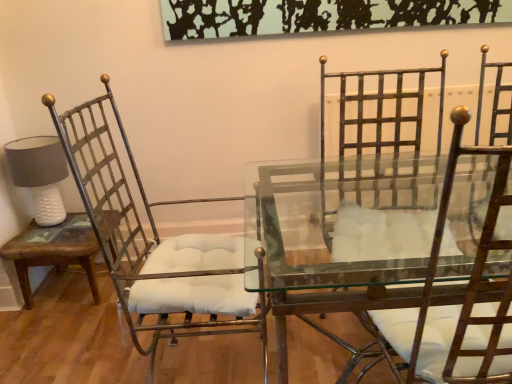
Question: Can you confirm if metallic iron chair at right, the second chair when ordered from left to right, is smaller than brown wood side table at left?

Choices:
 (A) yes
 (B) no

Answer: (B)

Question: From the image's perspective, is metallic iron chair at right, arranged as the first chair when viewed from the right, under brown wood side table at left?

Choices:
 (A) no
 (B) yes

Answer: (A)

Question: Does metallic iron chair at right, the second chair when ordered from left to right, have a lesser width compared to brown wood side table at left?

Choices:
 (A) no
 (B) yes

Answer: (A)

Question: Would you say metallic iron chair at right, arranged as the first chair when viewed from the right, contains brown wood side table at left?

Choices:
 (A) yes
 (B) no

Answer: (B)

Question: Is metallic iron chair at right, the second chair when ordered from left to right, at the right side of brown wood side table at left?

Choices:
 (A) no
 (B) yes

Answer: (B)

Question: Is metallic iron chair at right, the second chair when ordered from left to right, shorter than brown wood side table at left?

Choices:
 (A) no
 (B) yes

Answer: (A)

Question: Is brown wood side table at left not inside metallic iron chair at right, arranged as the first chair when viewed from the right?

Choices:
 (A) yes
 (B) no

Answer: (A)

Question: From the image's perspective, is brown wood side table at left located beneath metallic iron chair at right, arranged as the first chair when viewed from the right?

Choices:
 (A) yes
 (B) no

Answer: (A)

Question: Can you confirm if brown wood side table at left is positioned to the right of metallic iron chair at right, arranged as the first chair when viewed from the right?

Choices:
 (A) no
 (B) yes

Answer: (A)

Question: Is the surface of brown wood side table at left in direct contact with metallic iron chair at right, arranged as the first chair when viewed from the right?

Choices:
 (A) no
 (B) yes

Answer: (A)

Question: Considering the relative positions of brown wood side table at left and metallic iron chair at right, the second chair when ordered from left to right, in the image provided, is brown wood side table at left to the left of metallic iron chair at right, the second chair when ordered from left to right, from the viewer's perspective?

Choices:
 (A) no
 (B) yes

Answer: (B)

Question: From a real-world perspective, does brown wood side table at left sit lower than metallic iron chair at right, the second chair when ordered from left to right?

Choices:
 (A) yes
 (B) no

Answer: (A)

Question: Considering the relative sizes of metallic white cushioned chair at left, placed as the 1th chair when sorted from left to right, and brown wood side table at left in the image provided, is metallic white cushioned chair at left, placed as the 1th chair when sorted from left to right, shorter than brown wood side table at left?

Choices:
 (A) yes
 (B) no

Answer: (B)